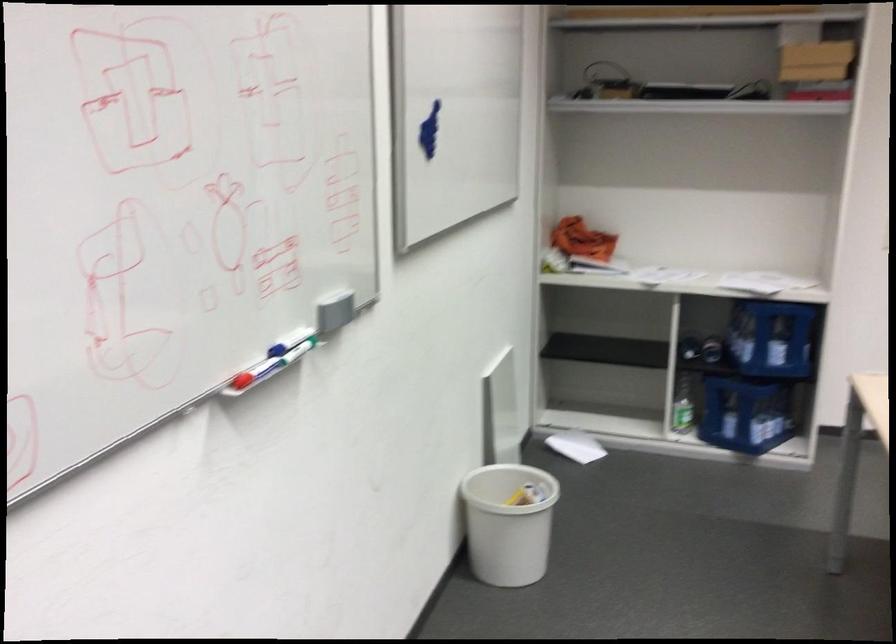
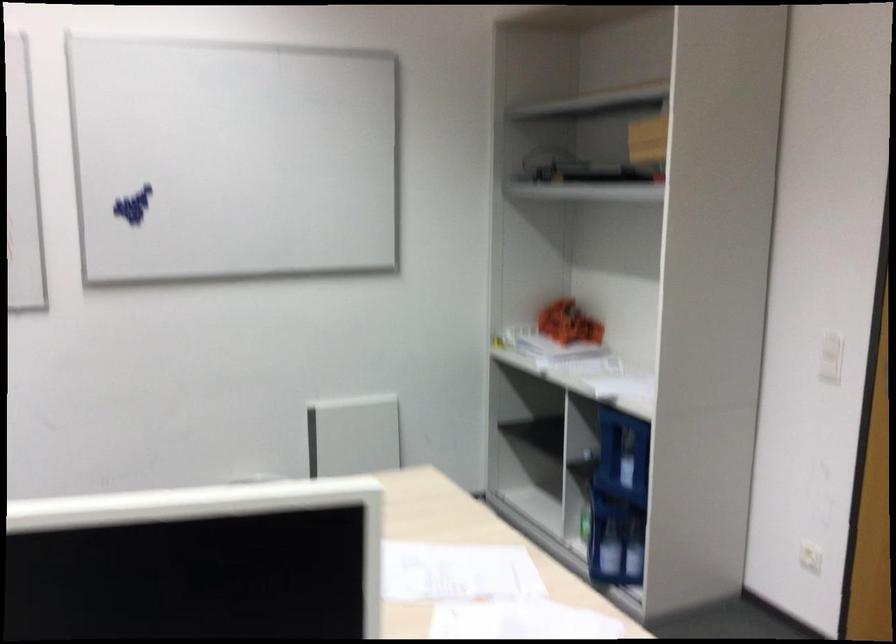
Find the pixel in the second image that matches pixel 739 447 in the first image.

(613, 550)